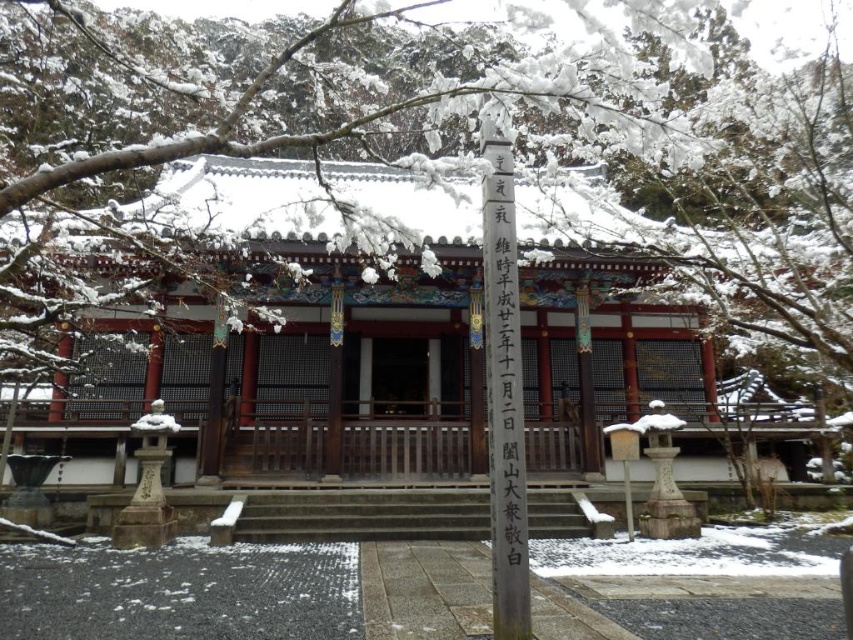
Question: From the image, what is the correct spatial relationship of black stone pole at center in relation to black wood signpost at center?

Choices:
 (A) left
 (B) right

Answer: (A)

Question: In this image, where is black stone pole at center located relative to black wood signpost at center?

Choices:
 (A) below
 (B) above

Answer: (B)

Question: Among these objects, which one is farthest from the camera?

Choices:
 (A) black stone pole at center
 (B) black wood signpost at center

Answer: (B)

Question: Is black stone pole at center smaller than black wood signpost at center?

Choices:
 (A) yes
 (B) no

Answer: (B)